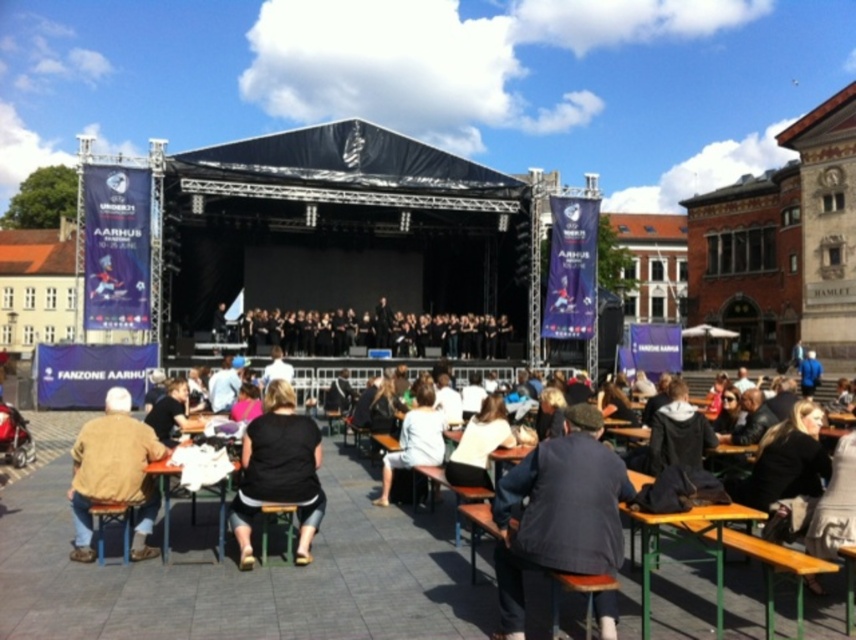
Is orange wooden table at lower right bigger than light beige cotton shirt at center?

No.

The width and height of the screenshot is (856, 640). What are the coordinates of `orange wooden table at lower right` in the screenshot? It's located at (676, 524).

Can you confirm if black fabric choir at center is bigger than wooden at center?

Correct, black fabric choir at center is larger in size than wooden at center.

Which is above, black fabric choir at center or wooden at center?

black fabric choir at center is higher up.

Which is behind, point (438, 348) or point (846, 556)?

The point (438, 348) is more distant.

Identify the location of black fabric choir at center. Image resolution: width=856 pixels, height=640 pixels. tap(377, 332).

Is black fabric shirt at center further to the viewer compared to wooden at center?

Yes, black fabric shirt at center is behind wooden at center.

Can you confirm if black fabric shirt at center is bigger than wooden at center?

Indeed, black fabric shirt at center has a larger size compared to wooden at center.

You are a GUI agent. You are given a task and a screenshot of the screen. Output one action in this format:
    pyautogui.click(x=<x>, y=<y>)
    Task: Click on the black fabric shirt at center
    The image size is (856, 640).
    Given the screenshot: What is the action you would take?
    pyautogui.click(x=278, y=472)